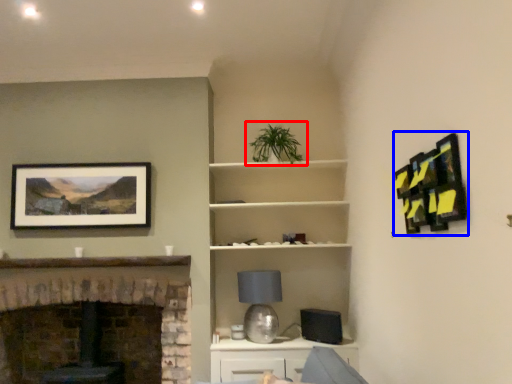
Question: Among these objects, which one is farthest to the camera, houseplant (highlighted by a red box) or picture frame (highlighted by a blue box)?

Choices:
 (A) houseplant
 (B) picture frame

Answer: (A)